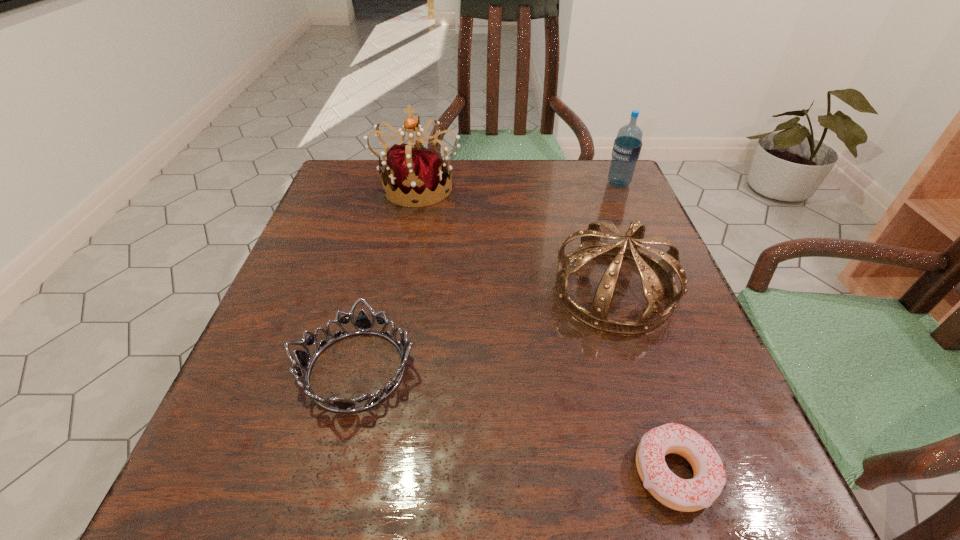
Where is `the tallest tiara`? The width and height of the screenshot is (960, 540). the tallest tiara is located at coordinates (417, 174).

I want to click on water bottle, so click(627, 146).

The width and height of the screenshot is (960, 540). I want to click on the second shortest tiara, so click(651, 270).

Find the location of `the third tallest object`. the third tallest object is located at coordinates (651, 270).

Where is `the shortest tiara`? The width and height of the screenshot is (960, 540). the shortest tiara is located at coordinates (362, 323).

You are a GUI agent. You are given a task and a screenshot of the screen. Output one action in this format:
    pyautogui.click(x=<x>, y=<y>)
    Task: Click on the nearest object
    
    Given the screenshot: What is the action you would take?
    pyautogui.click(x=687, y=495)

The image size is (960, 540). In order to click on doughnut in this screenshot , I will do `click(687, 495)`.

Where is `blank area located on the front-facing side of the tallest tiara`? The height and width of the screenshot is (540, 960). blank area located on the front-facing side of the tallest tiara is located at coordinates (x=399, y=279).

Identify the location of vacant space located 0.150m on the left of the water bottle. The height and width of the screenshot is (540, 960). (547, 184).

I want to click on vacant space situated 0.100m on the front of the second tallest tiara, so click(x=644, y=388).